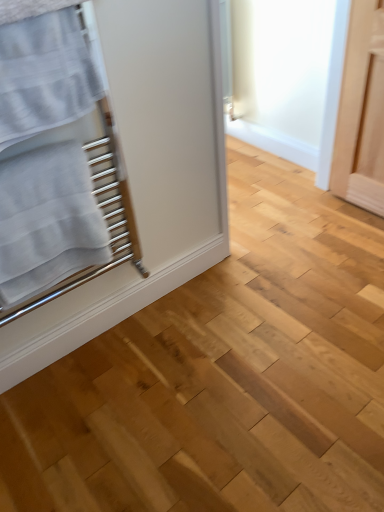
Find the location of a particular element. The image size is (384, 512). vacant location below white textured towel at left, acting as the first bath towel starting from the bottom (from a real-world perspective) is located at coordinates (86, 358).